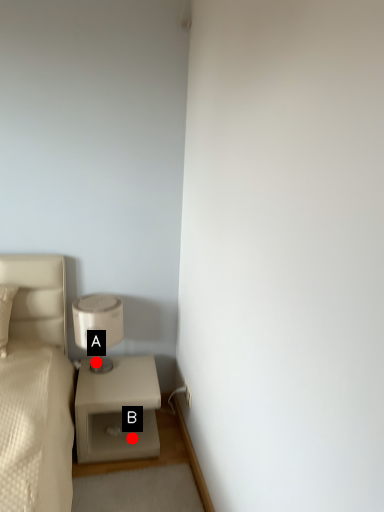
Question: Two points are circled on the image, labeled by A and B beside each circle. Which point is further to the camera?

Choices:
 (A) A is further
 (B) B is further

Answer: (A)